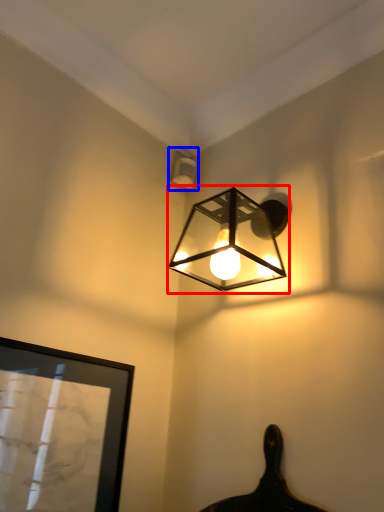
Question: Among these objects, which one is nearest to the camera, lamp (highlighted by a red box) or lamp (highlighted by a blue box)?

Choices:
 (A) lamp
 (B) lamp

Answer: (A)